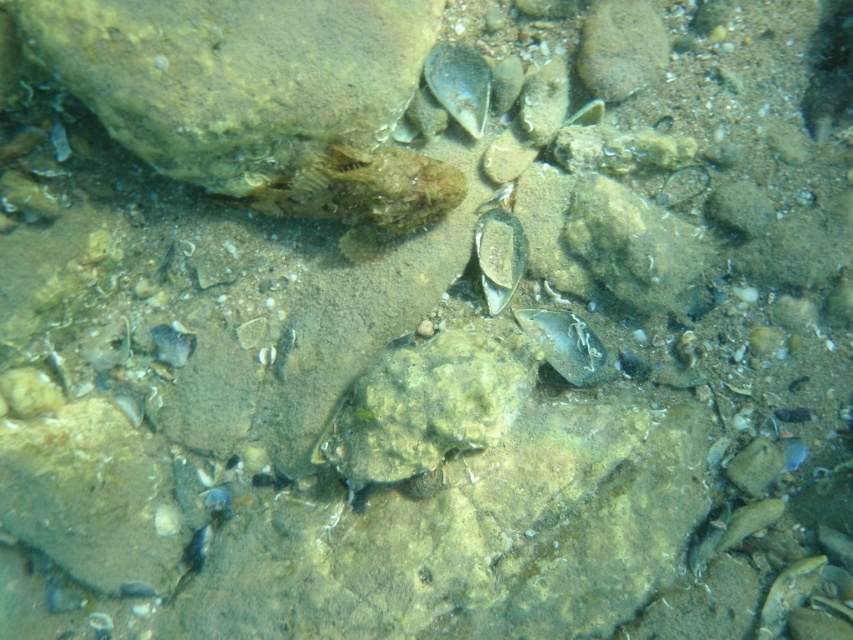
Question: Considering the real-world distances, which object is closest to the smooth brown rock at upper left?

Choices:
 (A) translucent plastic bag at center
 (B) smooth gray fish at bottom right
 (C) smooth gray shell at center

Answer: (C)

Question: Is the position of shiny blue shell at upper center more distant than that of translucent plastic bag at center?

Choices:
 (A) yes
 (B) no

Answer: (B)

Question: Considering the relative positions of smooth brown rock at upper left and smooth gray shell at center in the image provided, where is smooth brown rock at upper left located with respect to smooth gray shell at center?

Choices:
 (A) left
 (B) right

Answer: (A)

Question: Based on their relative distances, which object is nearer to the smooth gray shell at center?

Choices:
 (A) shiny blue shell at upper center
 (B) smooth brown rock at upper left
 (C) translucent plastic bag at center
 (D) smooth gray fish at bottom right

Answer: (C)

Question: Which of these objects is positioned farthest from the translucent plastic bag at center?

Choices:
 (A) smooth brown rock at upper left
 (B) smooth gray fish at bottom right
 (C) smooth gray shell at center
 (D) shiny blue shell at upper center

Answer: (A)

Question: Can you confirm if shiny blue shell at upper center is positioned to the left of smooth gray fish at bottom right?

Choices:
 (A) no
 (B) yes

Answer: (B)